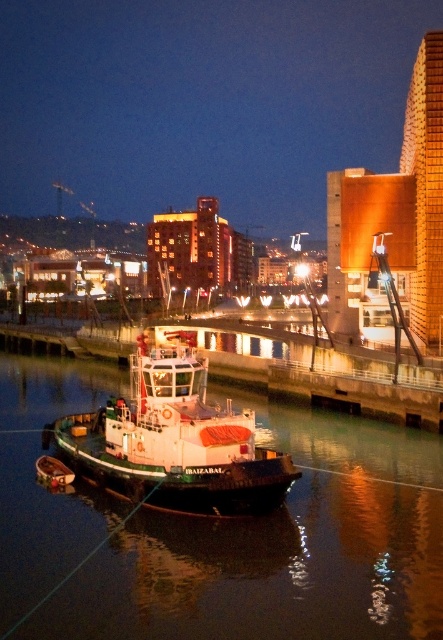
What do you see at coordinates (221, 531) in the screenshot?
I see `black rubber water at lower center` at bounding box center [221, 531].

Does black rubber water at lower center have a greater height compared to white matte boat at center?

Incorrect, black rubber water at lower center's height is not larger of white matte boat at center's.

The height and width of the screenshot is (640, 443). Find the location of `black rubber water at lower center`. black rubber water at lower center is located at coordinates click(221, 531).